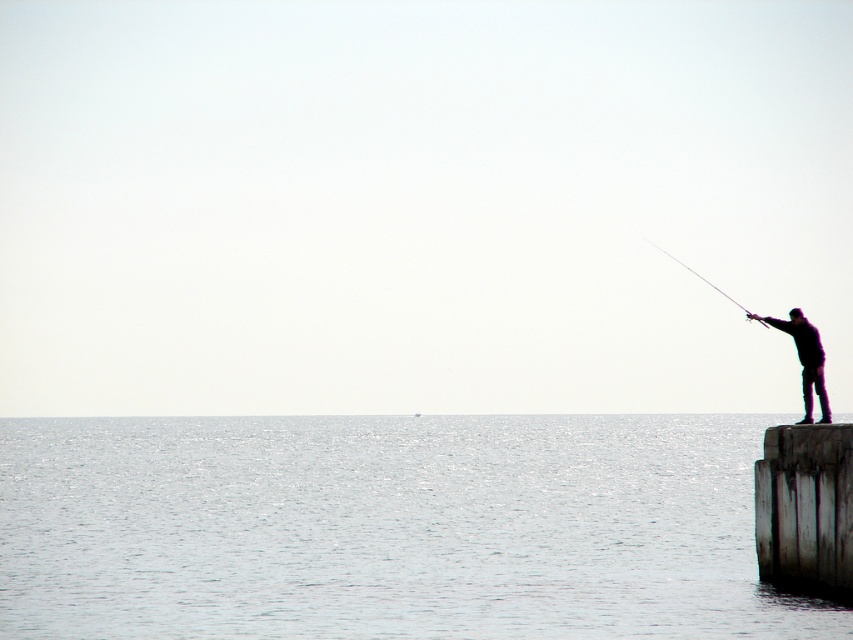
You are standing on the pier and want to cast your fishing rod towards the water. Based on the scene, which direction should you move the smooth black rod at right to reach the shiny blue water at lower left?

You should move the smooth black rod at right to the left since the shiny blue water at lower left is located to the left of the smooth black rod at right.

You are standing on the pier and want to place a small buoy between the two points labeled point (764, 504) and point (805, 388). Which point should the buoy be closer to in order to be closer to the camera?

The buoy should be closer to point (764, 504) since it is further to the camera than point (805, 388).

You are standing on the pier and want to place a small bucket between the shiny blue water at lower left and the dark matte clothing at right. Based on their sizes, which side should you place it closer to?

The shiny blue water at lower left has a larger width than the dark matte clothing at right, so you should place the bucket closer to the dark matte clothing at right to avoid it being too close to the wider water area.